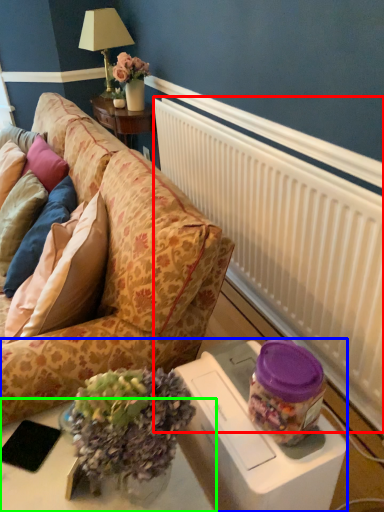
Question: Estimate the real-world distances between objects in this image. Which object is closer to radiator (highlighted by a red box), table (highlighted by a blue box) or table (highlighted by a green box)?

Choices:
 (A) table
 (B) table

Answer: (A)